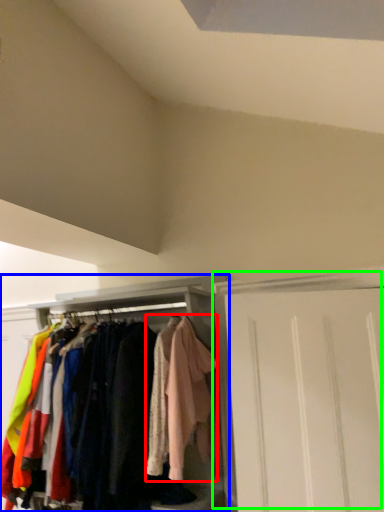
Question: Based on their relative distances, which object is nearer to clothing (highlighted by a red box)? Choose from cabinetry (highlighted by a blue box) and door (highlighted by a green box).

Choices:
 (A) cabinetry
 (B) door

Answer: (A)